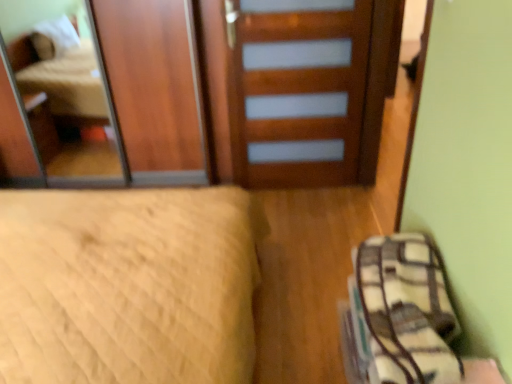
Question: Considering the relative sizes of wooden door at center and plaid fabric bag at lower right in the image provided, is wooden door at center bigger than plaid fabric bag at lower right?

Choices:
 (A) no
 (B) yes

Answer: (B)

Question: From a real-world perspective, is wooden door at center over plaid fabric bag at lower right?

Choices:
 (A) no
 (B) yes

Answer: (B)

Question: From the image's perspective, does wooden door at center appear higher than plaid fabric bag at lower right?

Choices:
 (A) yes
 (B) no

Answer: (A)

Question: Considering the relative positions of wooden door at center and plaid fabric bag at lower right in the image provided, is wooden door at center behind plaid fabric bag at lower right?

Choices:
 (A) no
 (B) yes

Answer: (B)

Question: Does wooden door at center lie in front of plaid fabric bag at lower right?

Choices:
 (A) yes
 (B) no

Answer: (B)

Question: Looking at their shapes, would you say plaid fabric bag at lower right is wider or thinner than wooden mirror at upper left?

Choices:
 (A) thin
 (B) wide

Answer: (B)

Question: Relative to wooden mirror at upper left, is plaid fabric bag at lower right in front or behind?

Choices:
 (A) front
 (B) behind

Answer: (A)

Question: Is plaid fabric bag at lower right to the left or to the right of wooden mirror at upper left in the image?

Choices:
 (A) left
 (B) right

Answer: (B)

Question: Do you think plaid fabric bag at lower right is within wooden mirror at upper left, or outside of it?

Choices:
 (A) inside
 (B) outside

Answer: (B)

Question: From the image's perspective, is wooden mirror at upper left above or below plaid fabric bag at lower right?

Choices:
 (A) above
 (B) below

Answer: (A)

Question: Would you say wooden mirror at upper left is to the left or to the right of plaid fabric bag at lower right in the picture?

Choices:
 (A) left
 (B) right

Answer: (A)

Question: In the image, is wooden mirror at upper left positioned in front of or behind plaid fabric bag at lower right?

Choices:
 (A) behind
 (B) front

Answer: (A)

Question: Is wooden mirror at upper left bigger or smaller than plaid fabric bag at lower right?

Choices:
 (A) big
 (B) small

Answer: (A)

Question: In terms of size, does plaid fabric bag at lower right appear bigger or smaller than wooden door at center?

Choices:
 (A) big
 (B) small

Answer: (B)

Question: Considering the relative positions of plaid fabric bag at lower right and wooden door at center in the image provided, is plaid fabric bag at lower right to the left or to the right of wooden door at center?

Choices:
 (A) right
 (B) left

Answer: (A)